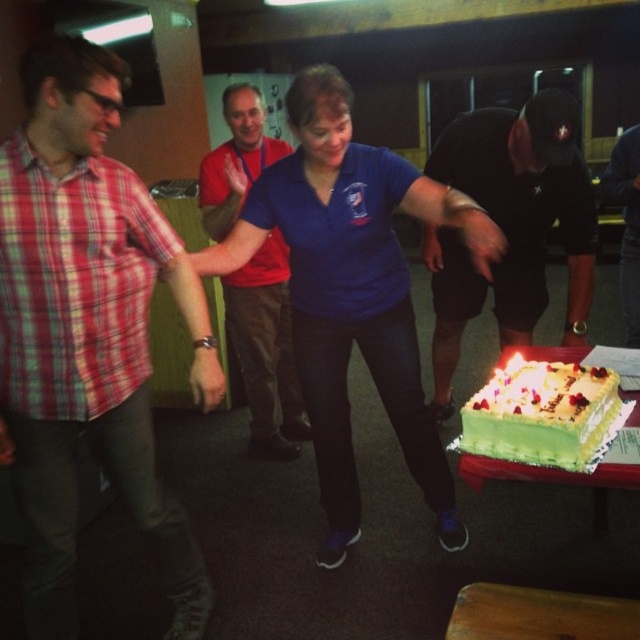
Question: Which is farther from the matte red shirt at center?

Choices:
 (A) plaid shirt at left
 (B) green frosted cake at lower right

Answer: (B)

Question: From the image, what is the correct spatial relationship of blue cotton shirt at center in relation to black matte shorts at lower right?

Choices:
 (A) left
 (B) right

Answer: (A)

Question: Does plaid shirt at left have a larger size compared to black cotton t-shirt at center?

Choices:
 (A) no
 (B) yes

Answer: (B)

Question: In this image, where is blue cotton shirt at center located relative to matte red shirt at center?

Choices:
 (A) below
 (B) above

Answer: (A)

Question: Which of the following is the farthest from the observer?

Choices:
 (A) (589, 419)
 (B) (570, 253)
 (C) (628, 333)

Answer: (C)

Question: Which point is closer to the camera?

Choices:
 (A) black matte shorts at lower right
 (B) black cotton t-shirt at center

Answer: (A)